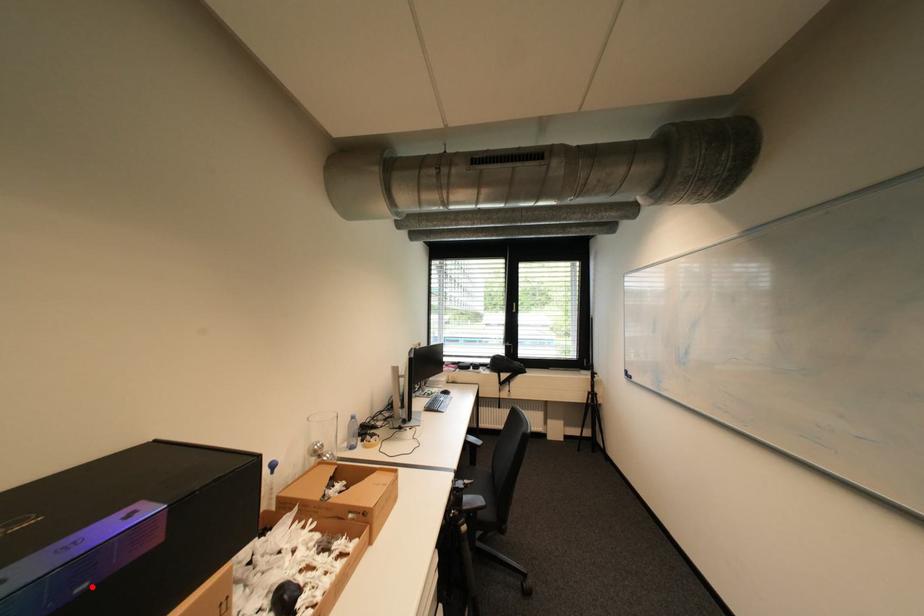
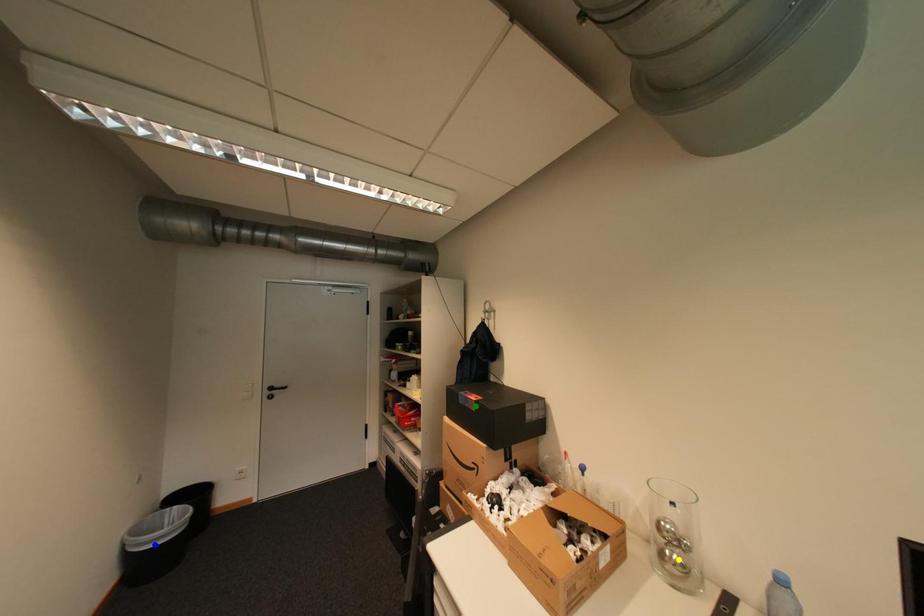
Question: I am providing you with two images of the same scene from different viewpoints. A red point is marked on the first image. You are given multiple points on the second image. Which point in image 2 represents the same 3d spot as the red point in image 1?

Choices:
 (A) yellow point
 (B) green point
 (C) blue point

Answer: (B)